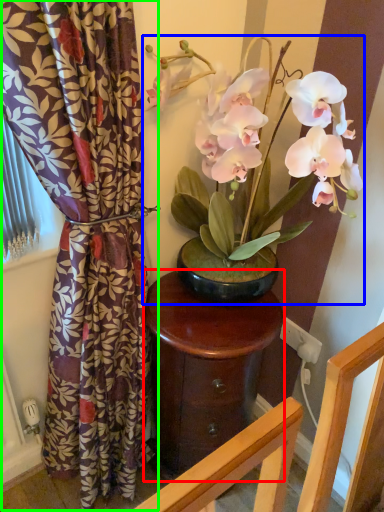
Question: Which is farther away from table (highlighted by a red box)? houseplant (highlighted by a blue box) or curtain (highlighted by a green box)?

Choices:
 (A) houseplant
 (B) curtain

Answer: (A)